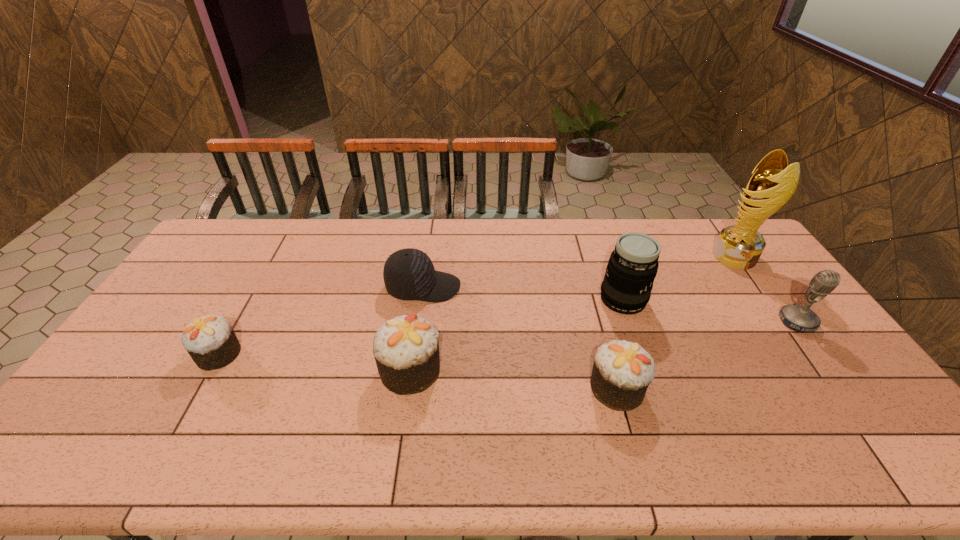
Where is `vacant region between the tallest object and the baseball cap`? The image size is (960, 540). vacant region between the tallest object and the baseball cap is located at coordinates (579, 272).

You are a GUI agent. You are given a task and a screenshot of the screen. Output one action in this format:
    pyautogui.click(x=<x>, y=<y>)
    Task: Click on the empty location between the telephoto lens and the microphone
    
    Given the screenshot: What is the action you would take?
    pyautogui.click(x=710, y=310)

Identify the location of unoccupied area between the baseball cap and the farthest object. This screenshot has width=960, height=540. (579, 272).

At what (x,y) coordinates should I click in order to perform the action: click on free spot between the second cupcake from left to right and the telephoto lens. Please return your answer as a coordinate pair (x, y). This screenshot has width=960, height=540. Looking at the image, I should click on (516, 335).

Select which object appears as the second closest to the second tallest cupcake. Please provide its 2D coordinates. Your answer should be formatted as a tuple, i.e. [(x, y)], where the tuple contains the x and y coordinates of a point satisfying the conditions above.

[(406, 348)]

Select which object appears as the second closest to the microphone. Please provide its 2D coordinates. Your answer should be formatted as a tuple, i.e. [(x, y)], where the tuple contains the x and y coordinates of a point satisfying the conditions above.

[(633, 265)]

Select which cupcake is the third closest to the baseball cap. Please provide its 2D coordinates. Your answer should be formatted as a tuple, i.e. [(x, y)], where the tuple contains the x and y coordinates of a point satisfying the conditions above.

[(622, 371)]

Select which cupcake is the second closest to the telephoto lens. Please provide its 2D coordinates. Your answer should be formatted as a tuple, i.e. [(x, y)], where the tuple contains the x and y coordinates of a point satisfying the conditions above.

[(406, 348)]

The width and height of the screenshot is (960, 540). What are the coordinates of `free region that satisfies the following two spatial constraints: 1. at the front of the baseball cap where the brim is located; 2. on the back side of the telephoto lens` in the screenshot? It's located at (421, 300).

The height and width of the screenshot is (540, 960). I want to click on free region that satisfies the following two spatial constraints: 1. at the front of the baseball cap where the brim is located; 2. on the left side of the telephoto lens, so click(x=421, y=300).